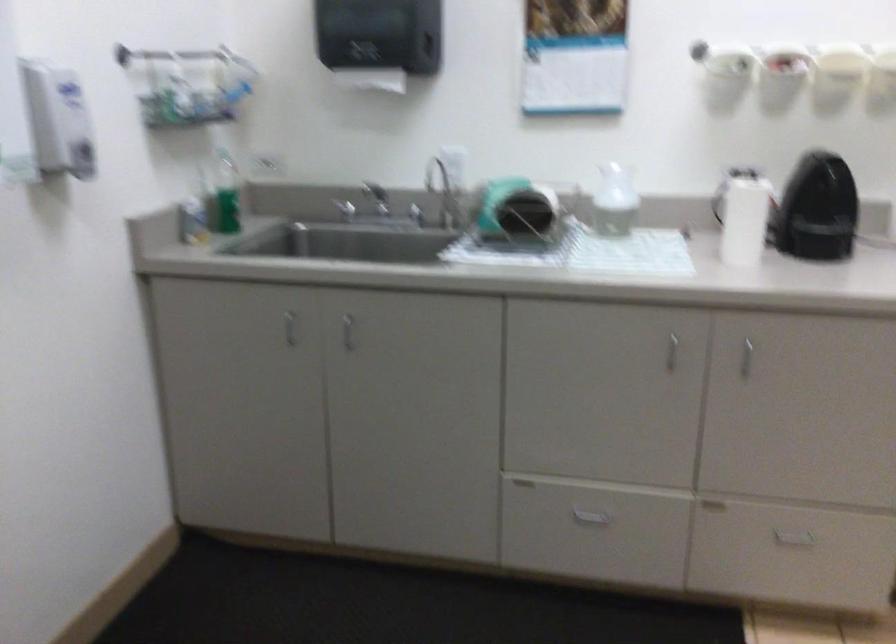
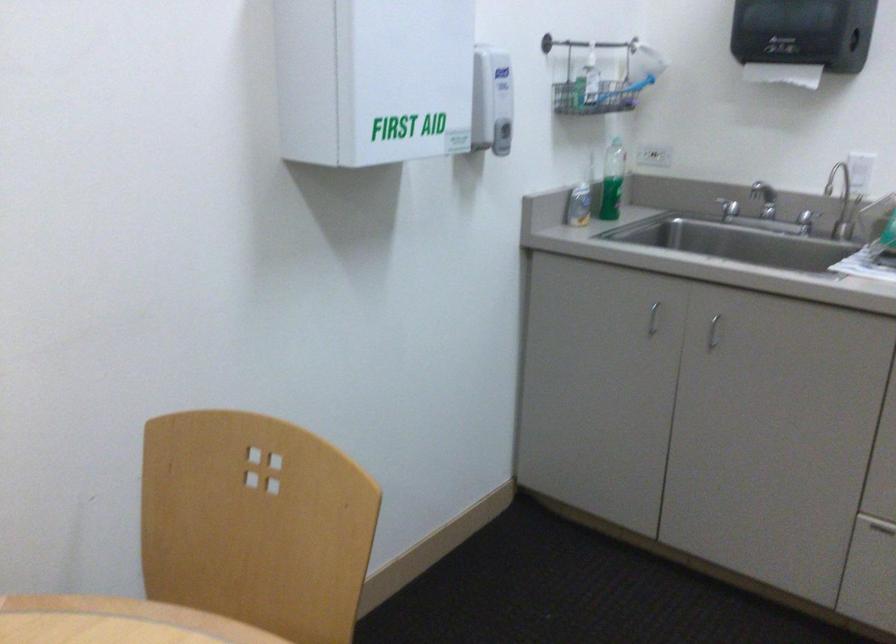
Locate, in the second image, the point that corresponds to (341,330) in the first image.

(712, 332)